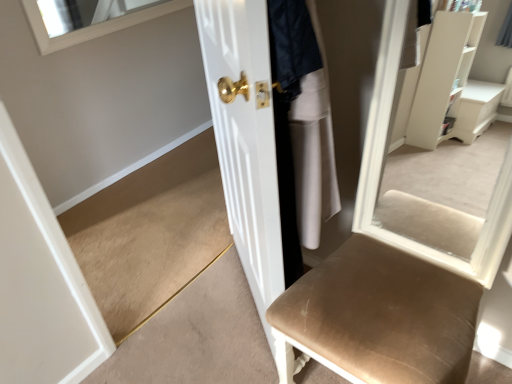
This screenshot has width=512, height=384. What do you see at coordinates (245, 139) in the screenshot? I see `white glossy door at center` at bounding box center [245, 139].

The image size is (512, 384). What are the coordinates of `white glossy door at center` in the screenshot? It's located at (245, 139).

What is the approximate width of white glossy door at center?

It is 6.42 inches.

Measure the distance between point (273, 240) and camera.

They are 1.14 meters apart.

Describe the element at coordinates (313, 148) in the screenshot. Image resolution: width=512 pixels, height=384 pixels. I see `white fabric skirt at center` at that location.

At what (x,y) coordinates should I click in order to perform the action: click on white fabric skirt at center. Please return your answer as a coordinate pair (x, y). The image size is (512, 384). Looking at the image, I should click on (313, 148).

I want to click on white glossy door at center, so click(245, 139).

Is white fabric skirt at center to the right of white glossy door at center from the viewer's perspective?

Correct, you'll find white fabric skirt at center to the right of white glossy door at center.

Does white fabric skirt at center lie in front of white glossy door at center?

That is False.

Considering the points (306, 246) and (257, 208), which point is in front, point (306, 246) or point (257, 208)?

The point (257, 208) is more forward.

From the image's perspective, between white fabric skirt at center and white glossy door at center, who is located below?

white glossy door at center, from the image's perspective.

From a real-world perspective, which object rests below the other?

In real-world perspective, white glossy door at center is lower.

Looking at their sizes, would you say white fabric skirt at center is wider or thinner than white glossy door at center?

Clearly, white fabric skirt at center has more width compared to white glossy door at center.

Does white fabric skirt at center have a lesser height compared to white glossy door at center?

Correct, white fabric skirt at center is not as tall as white glossy door at center.

Looking at the image, does white fabric skirt at center seem bigger or smaller compared to white glossy door at center?

Considering their sizes, white fabric skirt at center takes up less space than white glossy door at center.

Could white glossy door at center be considered to be inside white fabric skirt at center?

That's incorrect, white glossy door at center is not inside white fabric skirt at center.

Are white fabric skirt at center and white glossy door at center located far from each other?

No, white fabric skirt at center is not far away from white glossy door at center.

Consider the image. Could you tell me if white fabric skirt at center is facing white glossy door at center?

No.

Can you tell me how much white fabric skirt at center and white glossy door at center differ in facing direction?

They differ by 180 degrees in their facing directions.

I want to click on clothing on the right of white glossy door at center, so click(313, 148).

Between white glossy door at center and white fabric skirt at center, which one appears on the left side from the viewer's perspective?

white glossy door at center is more to the left.

Does white glossy door at center lie in front of white fabric skirt at center?

Yes, the depth of white glossy door at center is less than that of white fabric skirt at center.

Is point (208, 35) less distant than point (303, 223)?

No.

In the scene shown: From the image's perspective, is white glossy door at center above or below white fabric skirt at center?

Clearly, from the image's perspective, white glossy door at center is below white fabric skirt at center.

From a real-world perspective, which is physically below, white glossy door at center or white fabric skirt at center?

white glossy door at center, from a real-world perspective.

Is white glossy door at center thinner than white fabric skirt at center?

Indeed, white glossy door at center has a lesser width compared to white fabric skirt at center.

Is white glossy door at center taller or shorter than white fabric skirt at center?

Considering their sizes, white glossy door at center has more height than white fabric skirt at center.

Who is smaller, white glossy door at center or white fabric skirt at center?

white fabric skirt at center.

In the scene shown: Is white glossy door at center completely or partially outside of white fabric skirt at center?

Yes.

Is white glossy door at center far away from white fabric skirt at center?

They are positioned close to each other.

Is white glossy door at center facing away from white fabric skirt at center?

That's right, white glossy door at center is facing away from white fabric skirt at center.

Can you tell me how much white glossy door at center and white fabric skirt at center differ in facing direction?

white glossy door at center and white fabric skirt at center are facing 180 degrees away from each other.

Measure the distance from white glossy door at center to white fabric skirt at center.

white glossy door at center is 28.34 centimeters from white fabric skirt at center.

At what (x,y) coordinates should I click in order to perform the action: click on clothing above the white glossy door at center (from the image's perspective). Please return your answer as a coordinate pair (x, y). Looking at the image, I should click on (313, 148).

This screenshot has height=384, width=512. Identify the location of clothing above the white glossy door at center (from a real-world perspective). (313, 148).

Identify the location of door that is in front of the white fabric skirt at center. Image resolution: width=512 pixels, height=384 pixels. (245, 139).